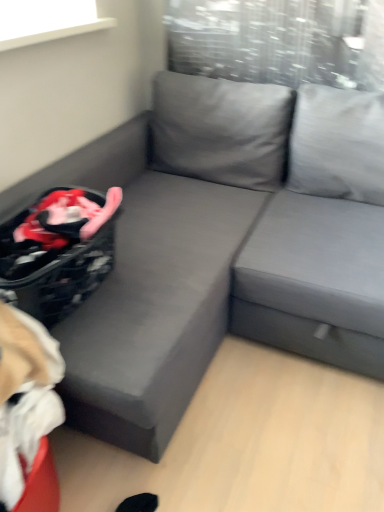
Question: Does point (21, 440) appear closer or farther from the camera than point (66, 269)?

Choices:
 (A) farther
 (B) closer

Answer: (B)

Question: In the image, is beige fabric bean bag chair at lower left on the left side or the right side of black textured laundry basket at lower left?

Choices:
 (A) left
 (B) right

Answer: (A)

Question: Estimate the real-world distances between objects in this image. Which object is farther from the black textured laundry basket at lower left?

Choices:
 (A) beige fabric bean bag chair at lower left
 (B) gray fabric couch at center

Answer: (B)

Question: Based on their relative distances, which object is nearer to the gray fabric couch at center?

Choices:
 (A) black textured laundry basket at lower left
 (B) beige fabric bean bag chair at lower left

Answer: (A)